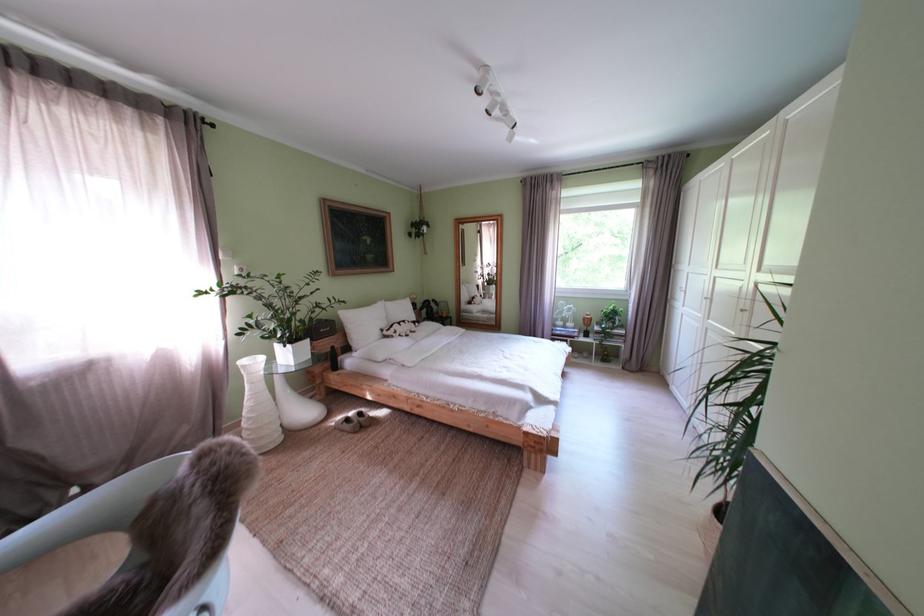
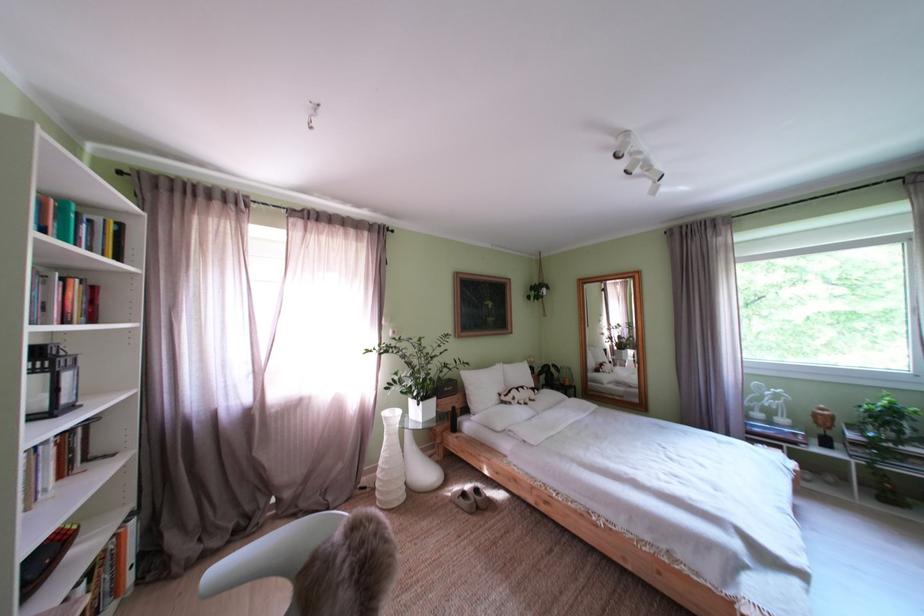
Where in the second image is the point corresponding to point 317,416 from the first image?

(438, 479)